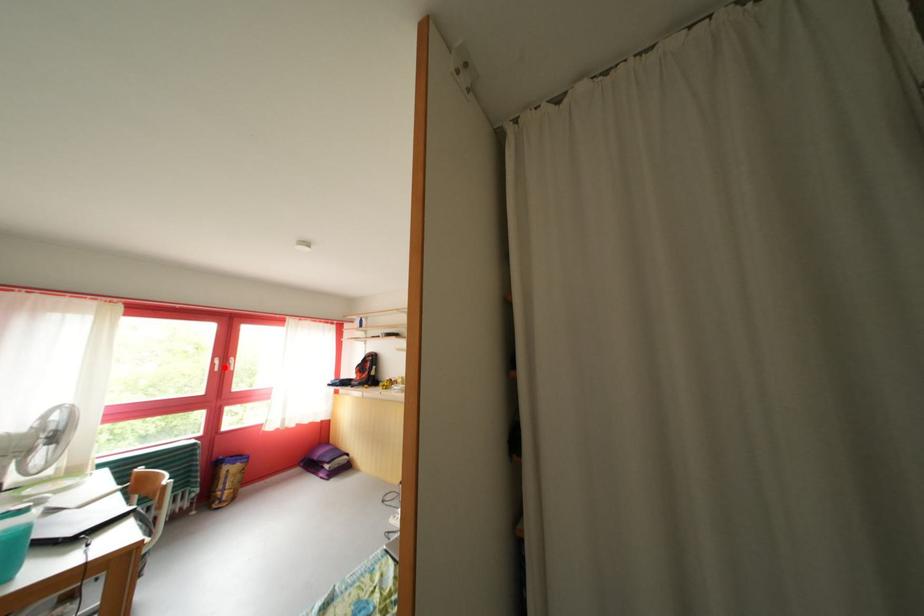
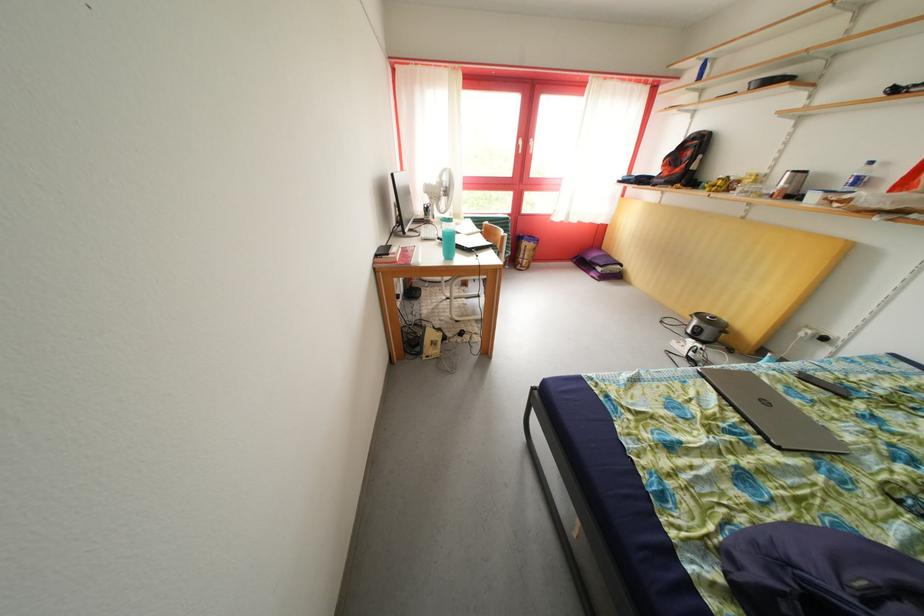
Where in the second image is the point corresponding to the highlighted location from the first image?

(528, 148)